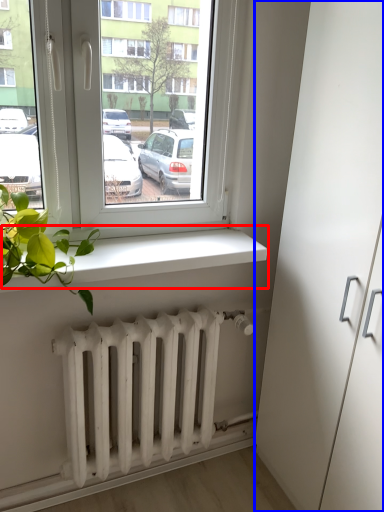
Question: Which object appears closest to the camera in this image, window sill (highlighted by a red box) or glass door (highlighted by a blue box)?

Choices:
 (A) window sill
 (B) glass door

Answer: (B)